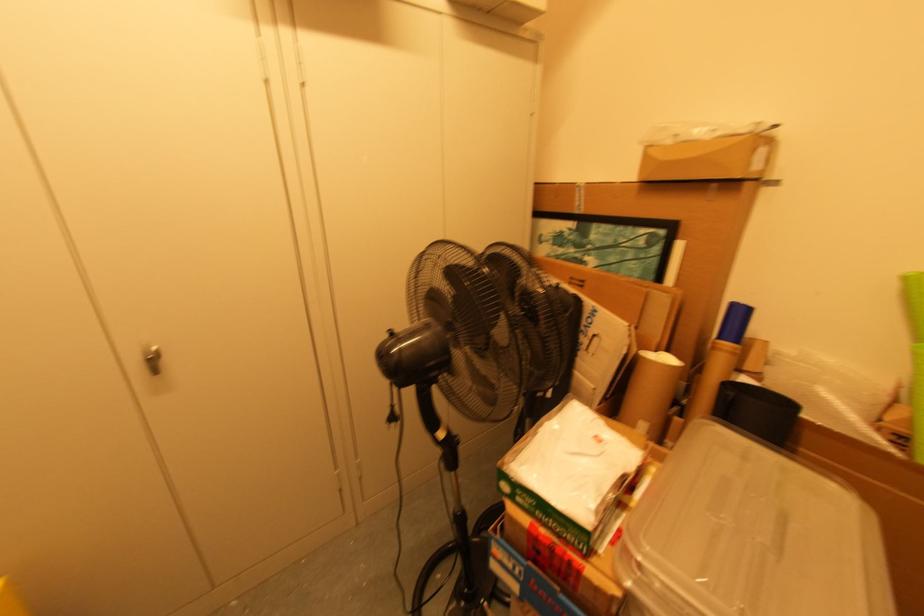
Where would you lift the cardboard tube? Please return your answer as a coordinate pair (x, y).

(650, 392)